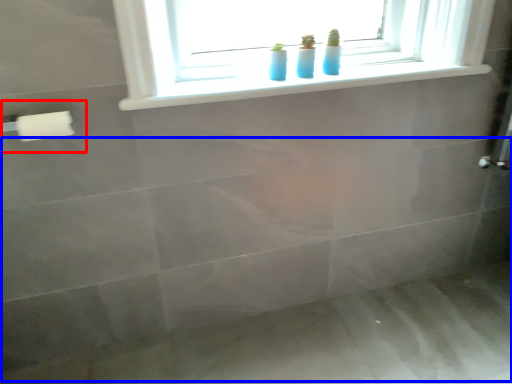
Question: Which object is closer to the camera taking this photo, towel bar (highlighted by a red box) or bath (highlighted by a blue box)?

Choices:
 (A) towel bar
 (B) bath

Answer: (A)